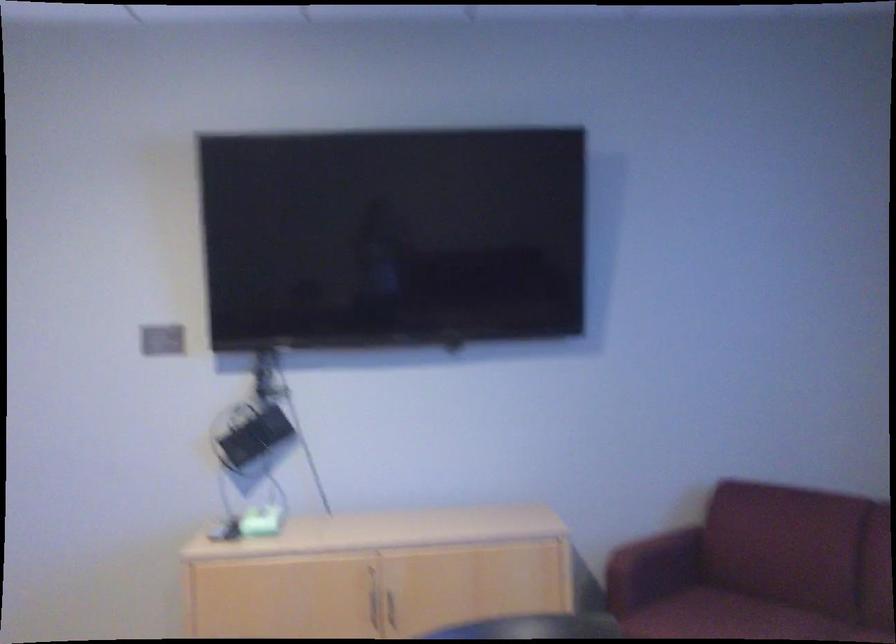
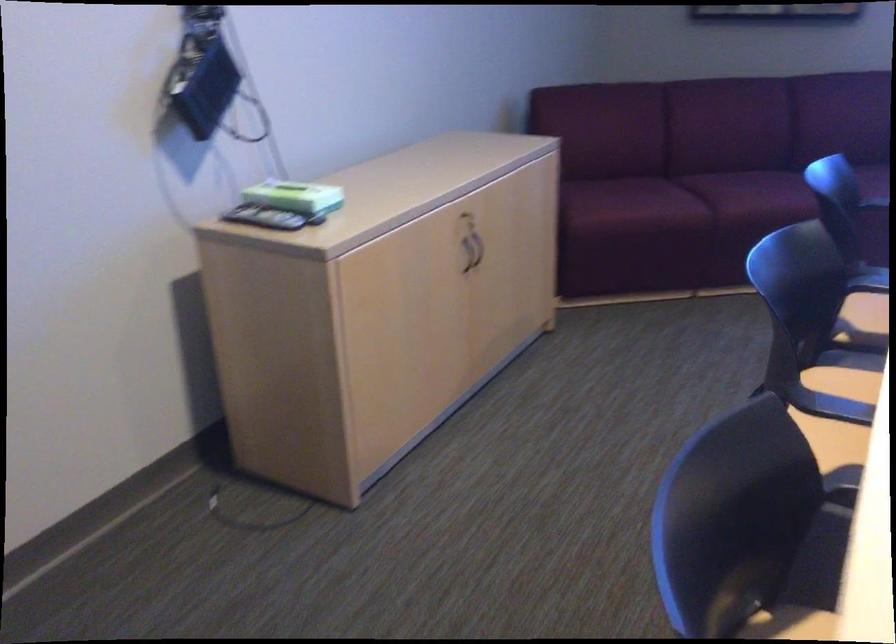
Question: I am providing you with two images of the same scene from different viewpoints. Please identify which objects are invisible in image2.

Choices:
 (A) cabinet lid
 (B) remote control
 (C) red chair armrest
 (D) Iron Man figurine

Answer: (C)